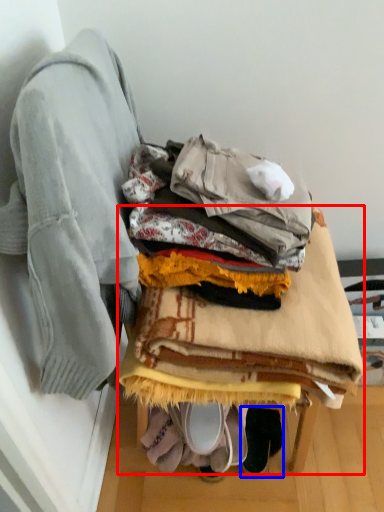
Question: Which of the following is the closest to the observer, furniture (highlighted by a red box) or footwear (highlighted by a blue box)?

Choices:
 (A) furniture
 (B) footwear

Answer: (A)